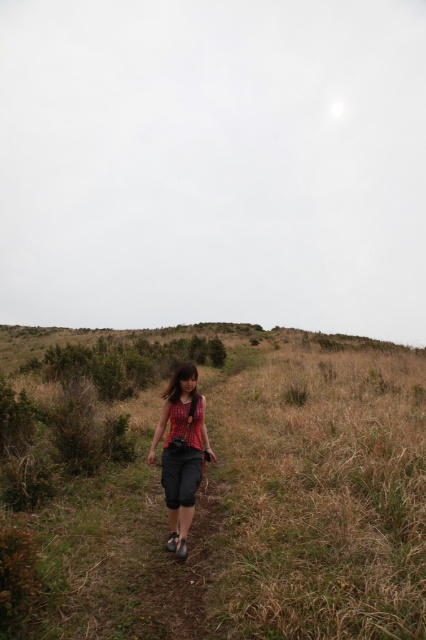
Based on the scene description, where is the dry grass at center located in terms of its 2D coordinates?

The dry grass at center is located at the 2D coordinate point of (213,486).

You are standing at the point marked as point (213, 486). What is the closest object to you in the scene?

The closest object to you at point (213, 486) is the dry grass at center.